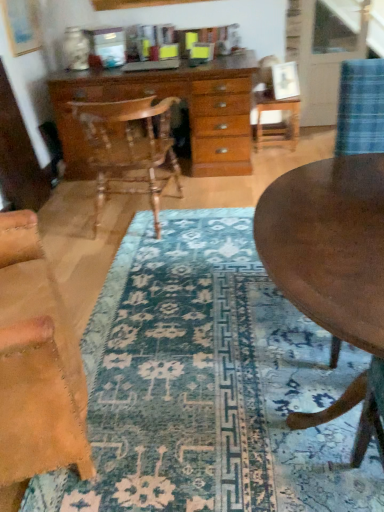
Question: From the image's perspective, would you say wooden chest of drawers at center is positioned over wooden polished chair at center, placed as the second chair when sorted from front to back?

Choices:
 (A) yes
 (B) no

Answer: (A)

Question: Is wooden chest of drawers at center closer to camera compared to wooden polished chair at center, the first chair viewed from the back?

Choices:
 (A) no
 (B) yes

Answer: (A)

Question: Does wooden chest of drawers at center have a greater width compared to wooden polished chair at center, placed as the 2th chair when sorted from bottom to top?

Choices:
 (A) no
 (B) yes

Answer: (B)

Question: Considering the relative positions of wooden chest of drawers at center and wooden polished chair at center, the first chair viewed from the back, in the image provided, is wooden chest of drawers at center to the left of wooden polished chair at center, the first chair viewed from the back, from the viewer's perspective?

Choices:
 (A) yes
 (B) no

Answer: (B)

Question: Does wooden chest of drawers at center appear on the right side of wooden polished chair at center, the first chair viewed from the back?

Choices:
 (A) no
 (B) yes

Answer: (B)

Question: In the image, is wooden polished chair at center, placed as the 2th chair when sorted from bottom to top, positioned in front of or behind wooden chest of drawers at center?

Choices:
 (A) behind
 (B) front

Answer: (B)

Question: Is wooden polished chair at center, which is the first chair in top-to-bottom order, wider or thinner than wooden chest of drawers at center?

Choices:
 (A) wide
 (B) thin

Answer: (B)

Question: Visually, is wooden polished chair at center, placed as the 2th chair when sorted from bottom to top, positioned to the left or to the right of wooden chest of drawers at center?

Choices:
 (A) left
 (B) right

Answer: (A)

Question: From a real-world perspective, is wooden polished chair at center, placed as the 2th chair when sorted from bottom to top, above or below wooden chest of drawers at center?

Choices:
 (A) above
 (B) below

Answer: (A)

Question: Is blue patterned rug at center to the left or to the right of wooden polished chair at center, placed as the 2th chair when sorted from bottom to top, in the image?

Choices:
 (A) right
 (B) left

Answer: (A)

Question: Considering the positions of blue patterned rug at center and wooden polished chair at center, the first chair viewed from the back, in the image, is blue patterned rug at center wider or thinner than wooden polished chair at center, the first chair viewed from the back,?

Choices:
 (A) wide
 (B) thin

Answer: (A)

Question: From the image's perspective, is blue patterned rug at center located above or below wooden polished chair at center, placed as the 2th chair when sorted from bottom to top?

Choices:
 (A) below
 (B) above

Answer: (A)

Question: In terms of height, does blue patterned rug at center look taller or shorter compared to wooden polished chair at center, which is the first chair in top-to-bottom order?

Choices:
 (A) tall
 (B) short

Answer: (B)

Question: From the image's perspective, is wooden polished chair at center, placed as the 2th chair when sorted from bottom to top, located above or below wooden round table at center?

Choices:
 (A) above
 (B) below

Answer: (A)

Question: Is wooden polished chair at center, placed as the 2th chair when sorted from bottom to top, inside the boundaries of wooden round table at center, or outside?

Choices:
 (A) inside
 (B) outside

Answer: (B)